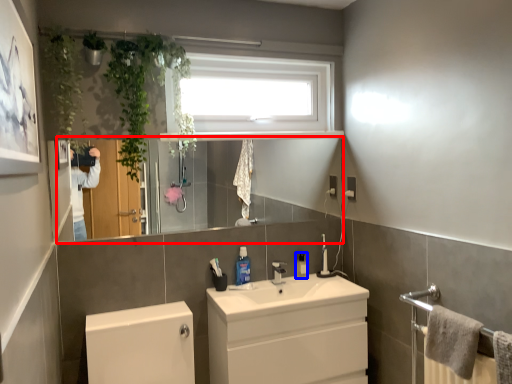
Question: Which object appears closest to the camera in this image, mirror (highlighted by a red box) or toiletry (highlighted by a blue box)?

Choices:
 (A) mirror
 (B) toiletry

Answer: (A)